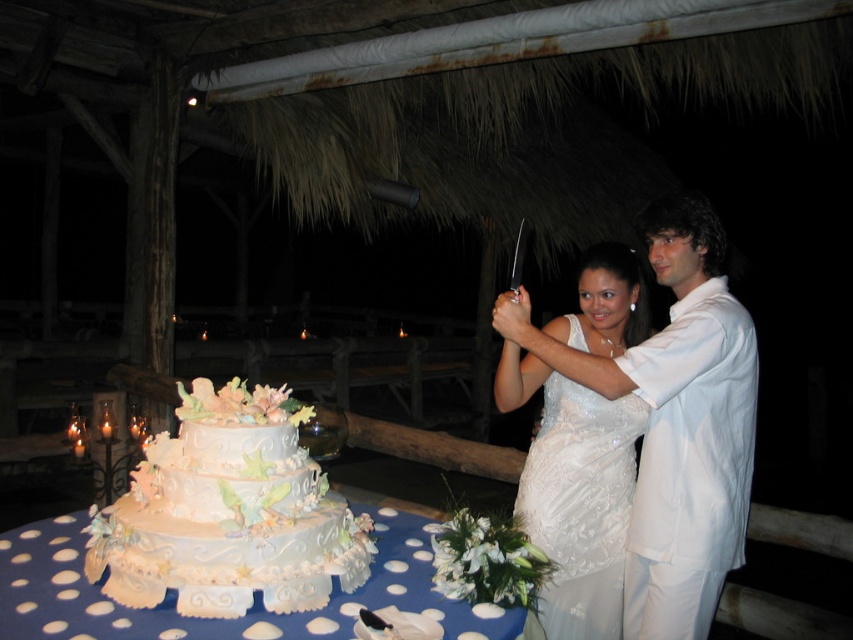
You are standing at the entrance of the pavilion and see two points marked in the image. Which point is closer to you, point (616, 628) or point (74, 630)?

Point (616, 628) is further to the viewer than point (74, 630), so the closer point to you is point (74, 630).

You are a photographer standing at the edge of the pavilion, and you want to take a photo of the white satin suit at right and the three tiered wedding cake. Can you fit both subjects in the frame if your camera has a 1.5 meter wide field of view?

The white satin suit at right and the three tiered wedding cake are 1.75 meters apart, which is wider than the camera field of view of 1.5 meters. Therefore, both subjects cannot be captured in a single frame.